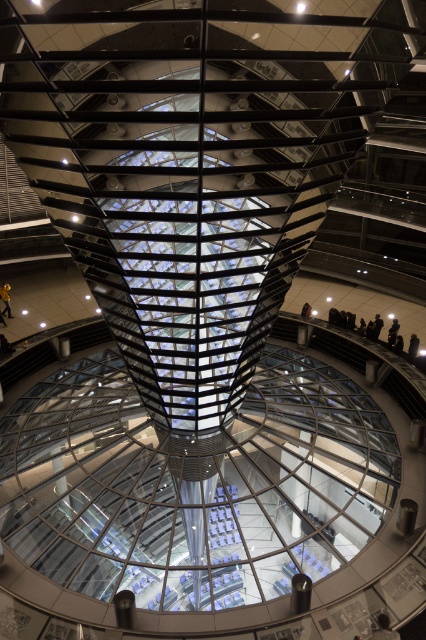
You are standing on the circular platform and see both the dark brown leather jacket at lower right and the yellow jacket at center. Which jacket is shorter in height?

The dark brown leather jacket at lower right has a lesser height compared to the yellow jacket at center, so the dark brown leather jacket at lower right is shorter.

You are standing in the modern architectural structure and see the point at coordinates (x=383, y=628). Which object is this point located on?

The point at coordinates (x=383, y=628) is located on the dark brown leather jacket at lower right.